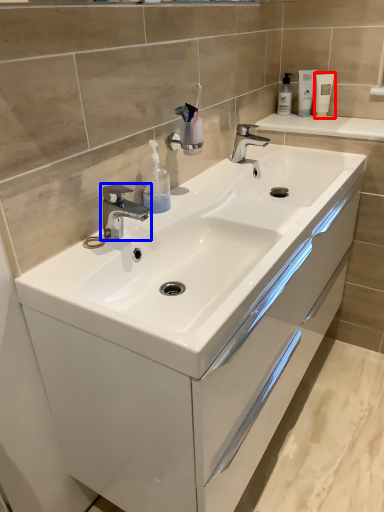
Question: Which object is further to the camera taking this photo, mouthwash (highlighted by a red box) or tap (highlighted by a blue box)?

Choices:
 (A) mouthwash
 (B) tap

Answer: (A)